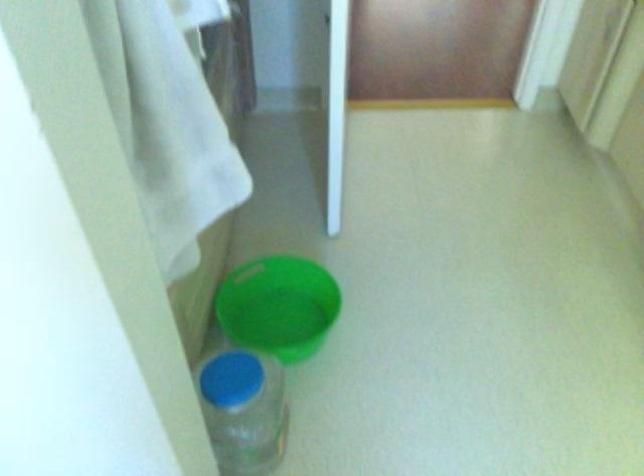
What are the coordinates of `blue jar lid` in the screenshot? It's located at (231, 378).